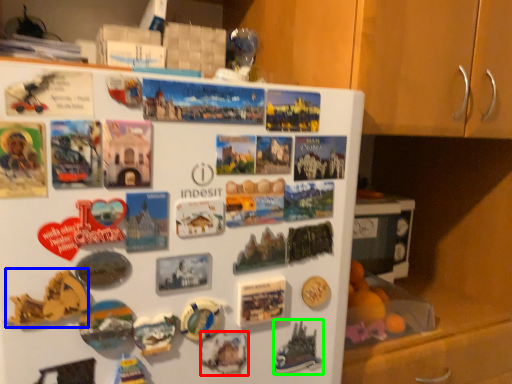
Question: Considering the real-world distances, which object is farthest from art (highlighted by a red box)? art (highlighted by a blue box) or art (highlighted by a green box)?

Choices:
 (A) art
 (B) art

Answer: (A)